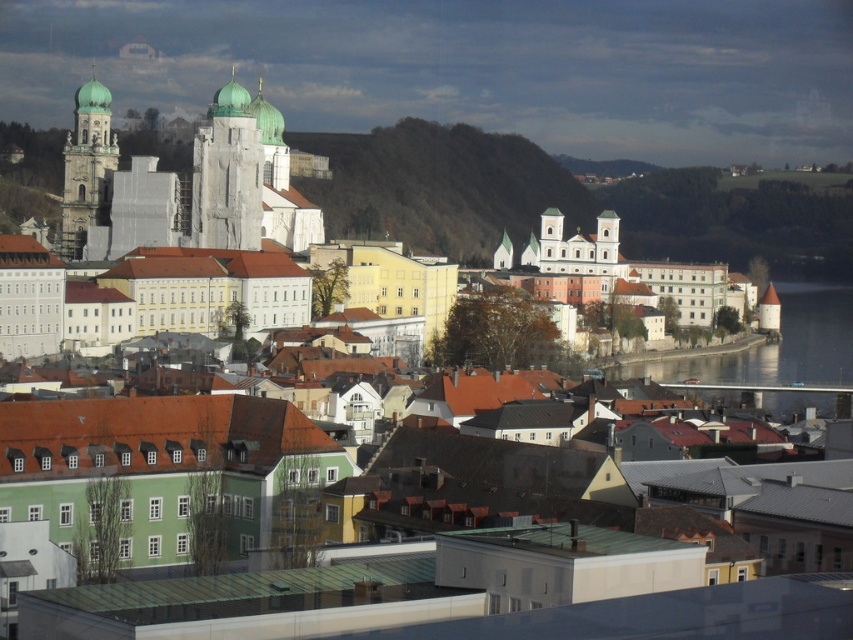
You are a tourist standing at the base of the matte white tower at left and want to take a photo of the bare earth hillside at center. Is the hillside visible from your current position?

The bare earth hillside at center is above the matte white tower at left, so yes, the hillside is visible from the base of the matte white tower at left as it is positioned higher up.

You are an architect evaluating the cityscape. You need to determine if the transparent glass water at river right can be seen over the white stone tower at center from the current viewpoint. Based on their heights, what do you conclude?

The transparent glass water at river right has a lesser height compared to the white stone tower at center, so it cannot be seen over the white stone tower at center from the current viewpoint.